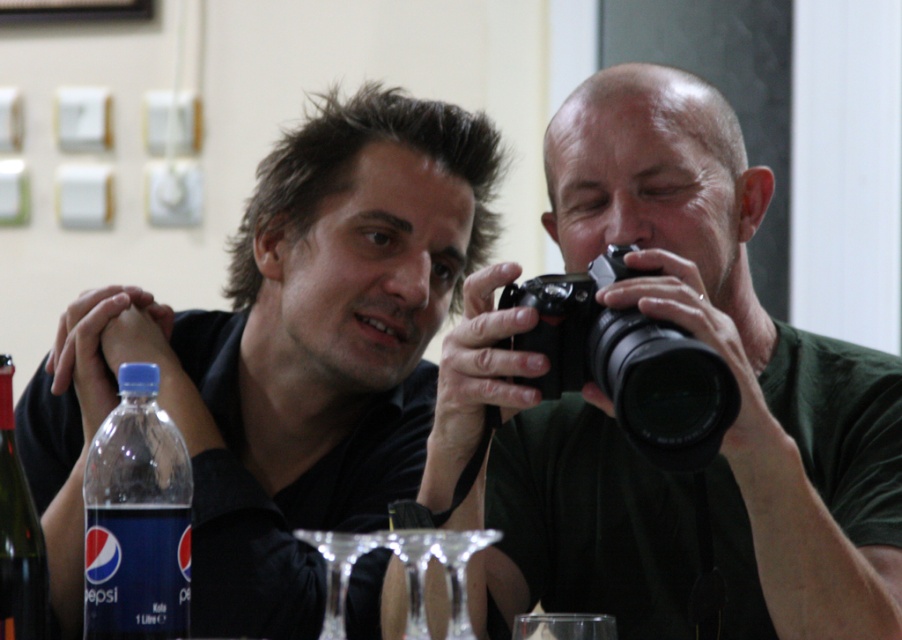
Which is above, blue plastic bottle at lower left or translucent glass bottle at lower left?

Positioned higher is translucent glass bottle at lower left.

Is point (122, 632) more distant than point (29, 579)?

Yes, it is.

Which is behind, point (127, 449) or point (14, 586)?

The point (127, 449) is more distant.

Locate an element on the screen. blue plastic bottle at lower left is located at coordinates (136, 518).

The width and height of the screenshot is (902, 640). What do you see at coordinates (286, 356) in the screenshot?
I see `matte black shirt at center` at bounding box center [286, 356].

Does point (210, 577) come farther from viewer compared to point (183, 508)?

Yes, it is.

Where is `matte black shirt at center`? The height and width of the screenshot is (640, 902). matte black shirt at center is located at coordinates (286, 356).

Which of these two, black matte camera at center or translucent glass bottle at lower left, stands taller?

black matte camera at center

Is black matte camera at center shorter than translucent glass bottle at lower left?

No, black matte camera at center is not shorter than translucent glass bottle at lower left.

Is point (726, 339) positioned before point (37, 577)?

No, (726, 339) is behind (37, 577).

Identify the location of black matte camera at center. (617, 419).